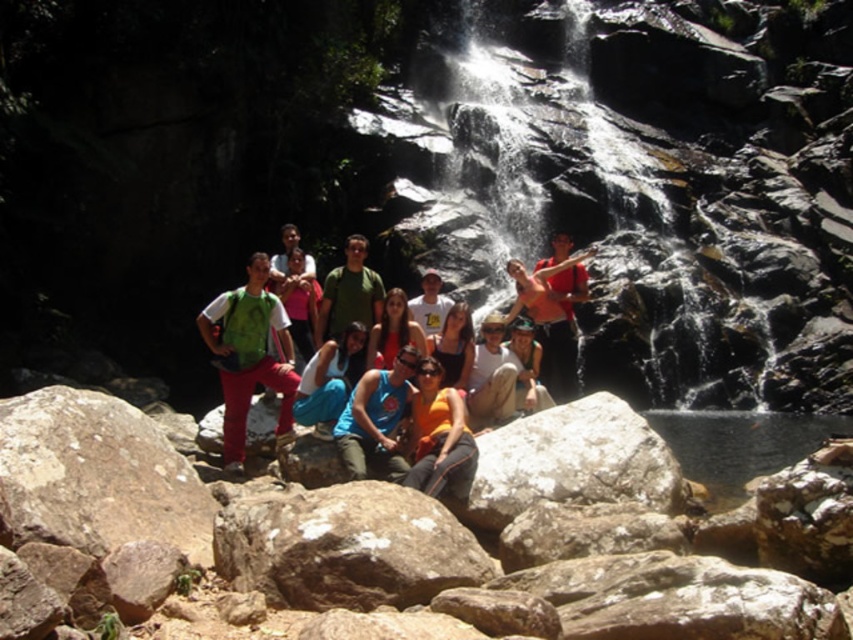
You are a photographer trying to capture a clear shot of the blue fabric tank top at center and orange fabric at center. Which object should you focus on first if you want to ensure both are in focus, considering their positions?

The blue fabric tank top at center has a greater height compared to orange fabric at center, so you should focus on the blue fabric tank top at center first to ensure both are in focus.

Looking at this image, you are a photographer trying to capture a clear shot of the blue fabric tank top at center and the orange fabric at center. Which object should you focus on first if you want to ensure both are in focus without adjusting the camera settings?

The blue fabric tank top at center is wider than the orange fabric at center, so focusing on the wider object first would help maintain focus on both.

You are standing at the point marked as point (341,545) in the image. What is the color of the ground beneath your feet?

The ground beneath your feet at point (341,545) is rocky brown at center.